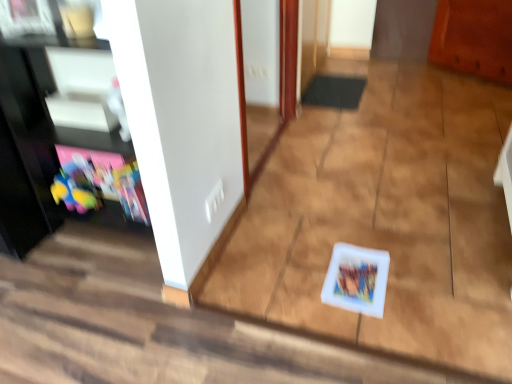
Find the location of a particular element. free space behind white matte card game at center is located at coordinates (345, 236).